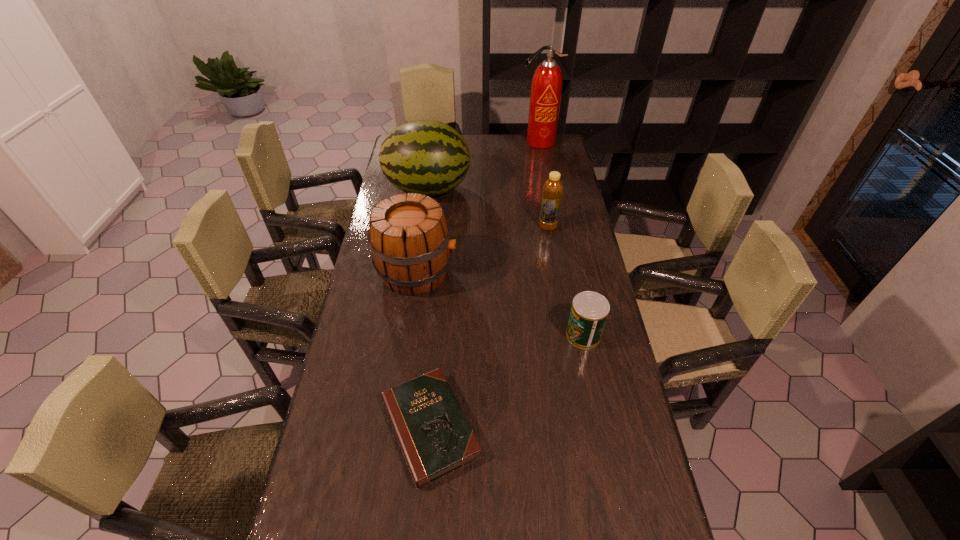
Find the location of `the tallest object`. the tallest object is located at coordinates (546, 88).

At what (x,y) coordinates should I click in order to perform the action: click on fire extinguisher. Please return your answer as a coordinate pair (x, y). Image resolution: width=960 pixels, height=540 pixels. Looking at the image, I should click on (546, 88).

Locate an element on the screen. The image size is (960, 540). the fifth nearest object is located at coordinates (428, 157).

Image resolution: width=960 pixels, height=540 pixels. Identify the location of the fourth farthest object. (409, 237).

Locate an element on the screen. The image size is (960, 540). bottle is located at coordinates (552, 191).

I want to click on the second shortest object, so click(589, 311).

Locate an element on the screen. This screenshot has height=540, width=960. can is located at coordinates (589, 311).

Where is `Bible`? Bible is located at coordinates (435, 437).

Image resolution: width=960 pixels, height=540 pixels. Find the location of `the nearest object`. the nearest object is located at coordinates click(435, 437).

In order to click on vacant space located on the left of the fire extinguisher in this screenshot , I will do `click(442, 142)`.